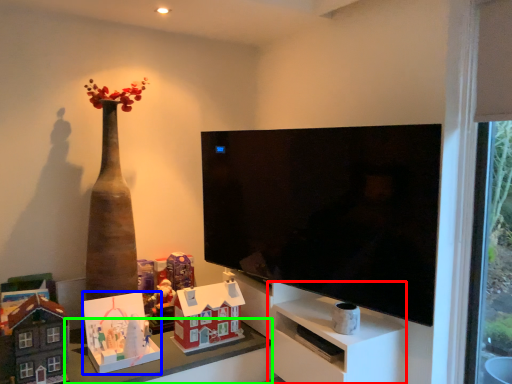
Question: Considering the real-world distances, which object is closest to entertainment center (highlighted by a red box)? toy (highlighted by a blue box) or table (highlighted by a green box).

Choices:
 (A) toy
 (B) table

Answer: (B)